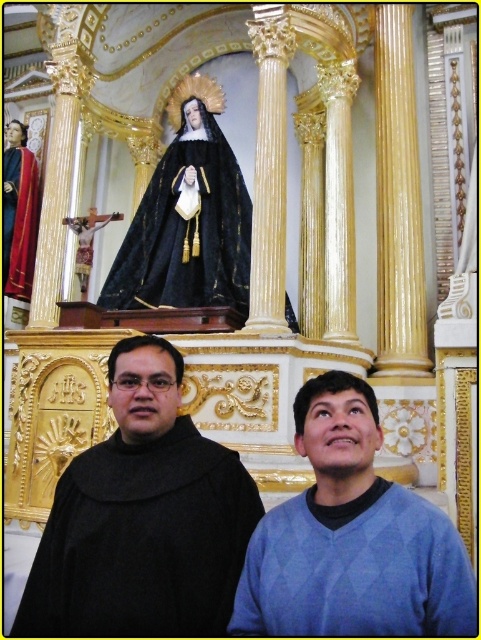
You are standing in the church scene and want to determine which of the two points, point (216,509) or point (8,266), is nearer to you. Based on the description, which point is closer?

Point (216,509) is closer to the camera than point (8,266), so it is the closer point.

You are an interior designer planning to hang a 1.2 meter tall painting above the altar. The painting must be placed between the black velvet robe at upper center and the velvet red robe at left. Given their heights, will the painting fit vertically between them without overlapping?

The black velvet robe at upper center is taller than the velvet red robe at left. Since the painting is 1.2 meters tall, it may not fit vertically between them if the vertical space between the two robes is less than 1.2 meters. However, the exact vertical distance isn